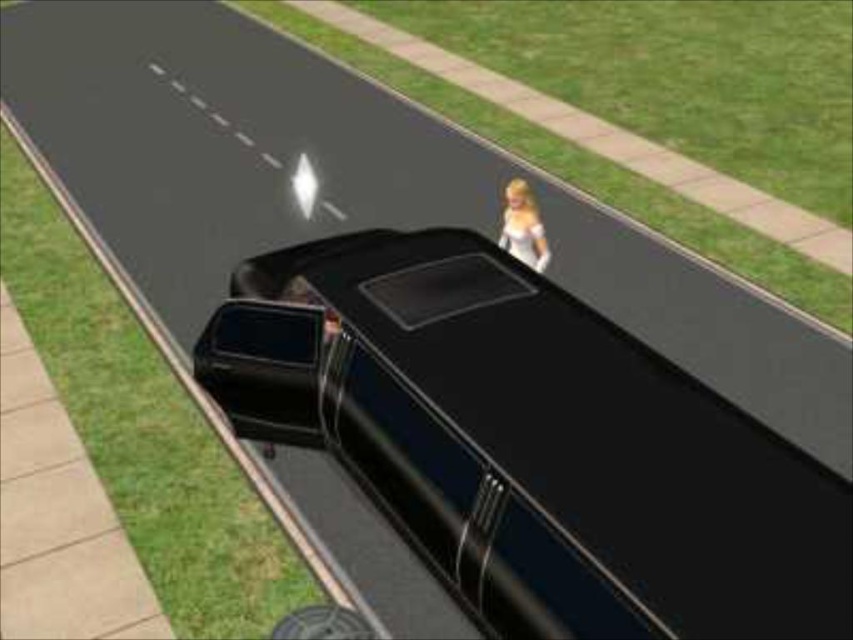
Is glossy black car at center below blonde hair doll at center?

Indeed, glossy black car at center is positioned under blonde hair doll at center.

Is glossy black car at center in front of blonde hair doll at center?

Yes, it is.

Which is behind, point (825, 474) or point (523, 241)?

The point (523, 241) is behind.

Where is `glossy black car at center`? The height and width of the screenshot is (640, 853). glossy black car at center is located at coordinates pyautogui.click(x=531, y=444).